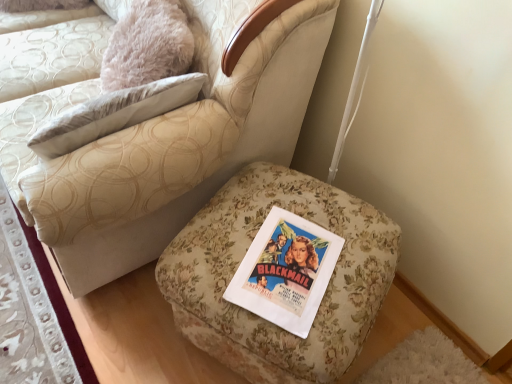
This screenshot has width=512, height=384. Find the location of `vacant space situated above floral fabric ottoman at lower right (from a real-world perspective)`. vacant space situated above floral fabric ottoman at lower right (from a real-world perspective) is located at coordinates (282, 229).